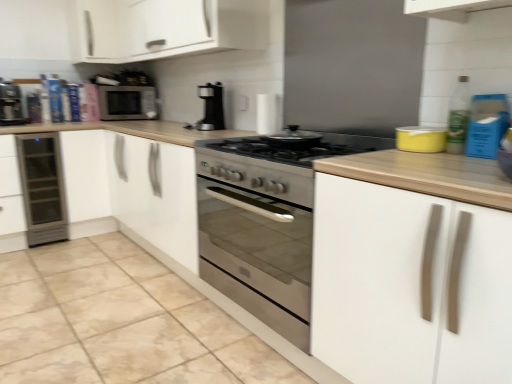
Question: Would you say matte black microwave at upper left is outside yellow matte container at upper right, which appears as the second appliance when viewed from the left?

Choices:
 (A) yes
 (B) no

Answer: (A)

Question: From a real-world perspective, is matte black microwave at upper left positioned under yellow matte container at upper right, which is counted as the first appliance, starting from the right, based on gravity?

Choices:
 (A) no
 (B) yes

Answer: (A)

Question: Considering the relative sizes of matte black microwave at upper left and yellow matte container at upper right, which appears as the second appliance when viewed from the back, in the image provided, is matte black microwave at upper left shorter than yellow matte container at upper right, which appears as the second appliance when viewed from the back,?

Choices:
 (A) yes
 (B) no

Answer: (B)

Question: Does matte black microwave at upper left appear on the right side of yellow matte container at upper right, which appears as the second appliance when viewed from the back?

Choices:
 (A) yes
 (B) no

Answer: (B)

Question: Can you see matte black microwave at upper left touching yellow matte container at upper right, which appears as the second appliance when viewed from the left?

Choices:
 (A) no
 (B) yes

Answer: (A)

Question: Is black plastic coffee maker at center bigger or smaller than stainless steel gas stove at center?

Choices:
 (A) big
 (B) small

Answer: (B)

Question: From their relative heights in the image, would you say black plastic coffee maker at center is taller or shorter than stainless steel gas stove at center?

Choices:
 (A) short
 (B) tall

Answer: (B)

Question: From a real-world perspective, relative to stainless steel gas stove at center, is black plastic coffee maker at center vertically above or below?

Choices:
 (A) above
 (B) below

Answer: (A)

Question: Considering the positions of black plastic coffee maker at center and stainless steel gas stove at center in the image, is black plastic coffee maker at center wider or thinner than stainless steel gas stove at center?

Choices:
 (A) thin
 (B) wide

Answer: (A)

Question: Is sleek stainless steel wine cooler at left situated inside stainless steel gas stove at center or outside?

Choices:
 (A) inside
 (B) outside

Answer: (B)

Question: Is sleek stainless steel wine cooler at left bigger or smaller than stainless steel gas stove at center?

Choices:
 (A) big
 (B) small

Answer: (A)

Question: Does point (50, 226) appear closer or farther from the camera than point (286, 157)?

Choices:
 (A) closer
 (B) farther

Answer: (B)

Question: From the image's perspective, is sleek stainless steel wine cooler at left above or below stainless steel gas stove at center?

Choices:
 (A) below
 (B) above

Answer: (A)

Question: From the image's perspective, relative to matte black coffee machine at left, is yellow matte container at upper right, which appears as the second appliance when viewed from the left, above or below?

Choices:
 (A) above
 (B) below

Answer: (B)

Question: In terms of size, does yellow matte container at upper right, the first appliance in the front-to-back sequence, appear bigger or smaller than matte black coffee machine at left?

Choices:
 (A) small
 (B) big

Answer: (A)